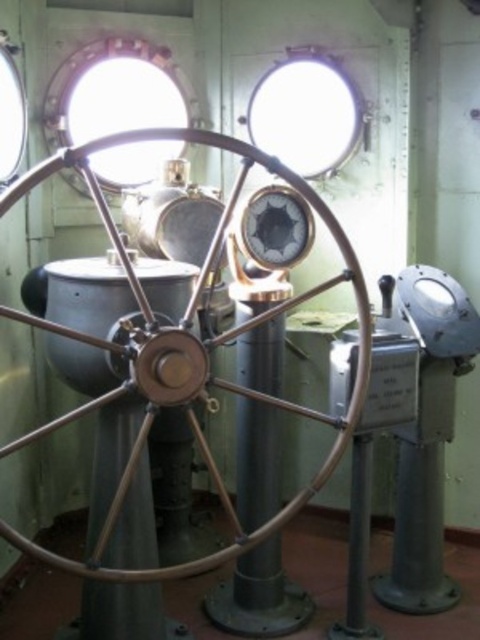
Measure the distance between polished brass wheel at center and camera.

polished brass wheel at center and camera are 1.84 meters apart.

Can you confirm if polished brass wheel at center is smaller than clear glass window at upper center?

No, polished brass wheel at center is not smaller than clear glass window at upper center.

Is point (21, 536) in front of point (252, 140)?

Yes.

The width and height of the screenshot is (480, 640). I want to click on polished brass wheel at center, so click(x=184, y=353).

Is clear glass porthole at upper left behind clear glass window at upper center?

That is False.

Can you confirm if clear glass porthole at upper left is shorter than clear glass window at upper center?

In fact, clear glass porthole at upper left may be taller than clear glass window at upper center.

Where is `clear glass porthole at upper left`? clear glass porthole at upper left is located at coordinates (115, 92).

From the picture: Is polished brass wheel at center to the left of clear glass porthole at upper left from the viewer's perspective?

No, polished brass wheel at center is not to the left of clear glass porthole at upper left.

Does polished brass wheel at center have a greater width compared to clear glass porthole at upper left?

Yes.

Is point (101, 346) closer to camera compared to point (62, 61)?

Yes, it is.

Where is `polished brass wheel at center`? Image resolution: width=480 pixels, height=640 pixels. polished brass wheel at center is located at coordinates (184, 353).